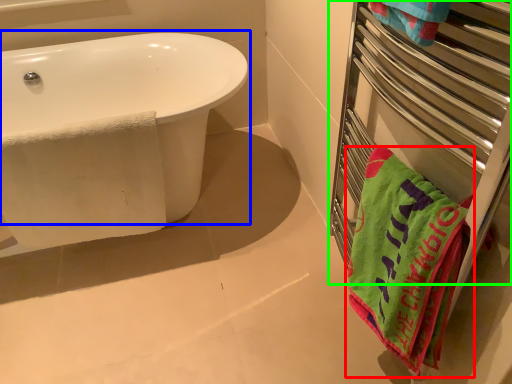
Question: Which is farther away from towel (highlighted by a red box)? bathtub (highlighted by a blue box) or balustrade (highlighted by a green box)?

Choices:
 (A) bathtub
 (B) balustrade

Answer: (A)